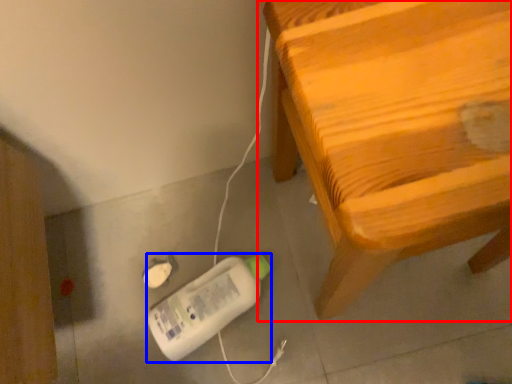
Question: Which of the following is the closest to the observer, furniture (highlighted by a red box) or equipment (highlighted by a blue box)?

Choices:
 (A) furniture
 (B) equipment

Answer: (A)